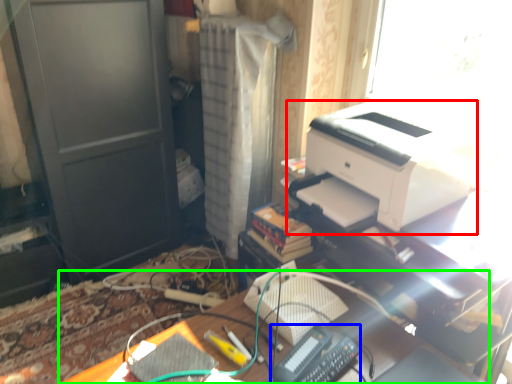
Question: Based on their relative distances, which object is nearer to printer (highlighted by a red box)? Choose from equipment (highlighted by a blue box) and desk (highlighted by a green box).

Choices:
 (A) equipment
 (B) desk

Answer: (B)